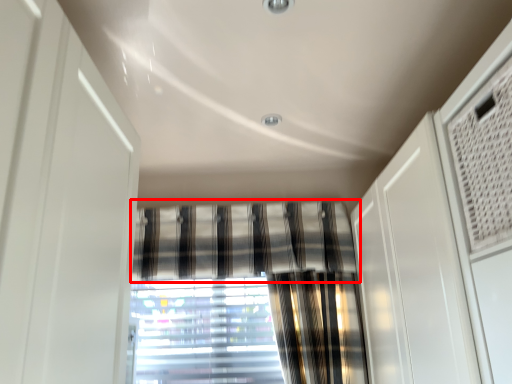
Question: From the image's perspective, what is the correct spatial relationship of curtain (annotated by the red box) in relation to window?

Choices:
 (A) below
 (B) above

Answer: (B)